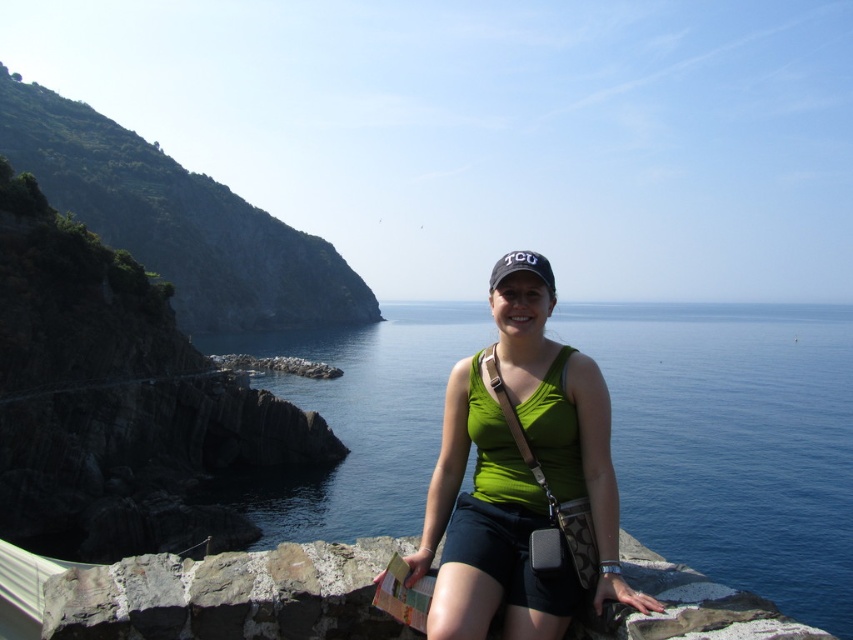
You are a photographer planning to take a wide shot of the coastal scene. You want to include both the blue water at center and the rough textured stone at lower left in your frame. Given their sizes, which object will occupy more space in the photo?

The blue water at center will occupy more space in the photo because it is bigger than the rough textured stone at lower left according to the description.

You are a photographer standing at the edge of the cliff, aiming to capture the person in the green sleeveless top at center. The camera has a focus point set at coordinate point (521,477). Will the focus point successfully capture the person?

Yes, the focus point at coordinate point (521,477) is exactly where the green fabric tank top at center is located, so the focus point will successfully capture the person.

You are a photographer trying to capture the person in the green fabric tank top at center and the green rocky cliff at left in the same frame. Based on their positions, which object is closer to the left edge of the photo?

The green rocky cliff at left is closer to the left edge of the photo because the green fabric tank top at center is to the right of it.